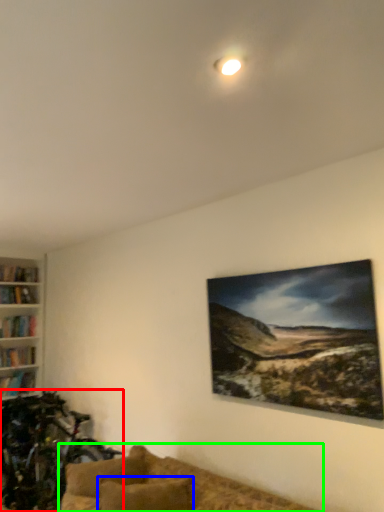
Question: Based on their relative distances, which object is nearer to mountain bike (highlighted by a red box)? Choose from pillow (highlighted by a blue box) and studio couch (highlighted by a green box).

Choices:
 (A) pillow
 (B) studio couch

Answer: (B)